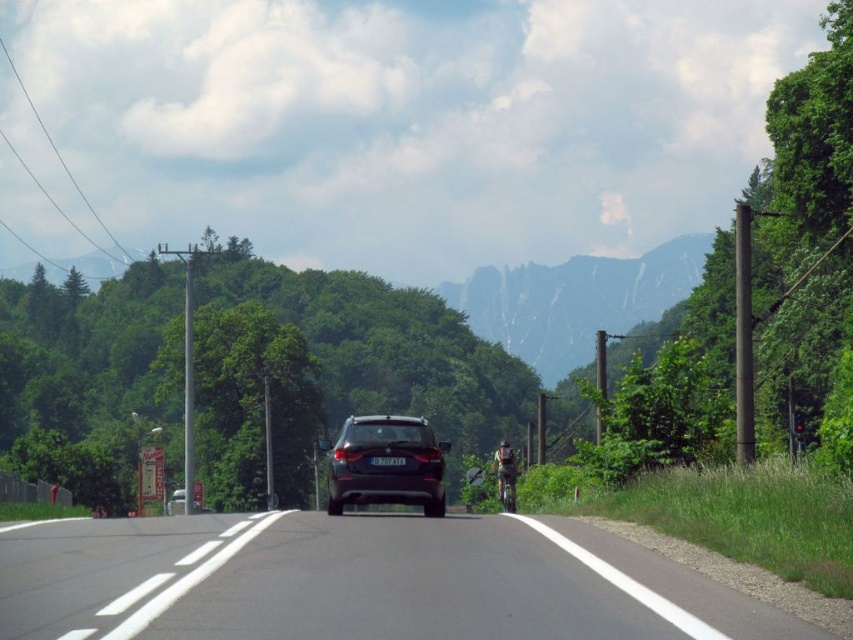
Who is shorter, black asphalt road at center or shiny metallic motorcycle at center?

black asphalt road at center is shorter.

Is black asphalt road at center shorter than shiny metallic motorcycle at center?

Yes, black asphalt road at center is shorter than shiny metallic motorcycle at center.

Is point (416, 564) closer to camera compared to point (512, 472)?

Yes, it is.

This screenshot has width=853, height=640. In order to click on black asphalt road at center in this screenshot , I will do `click(360, 580)`.

This screenshot has height=640, width=853. Find the location of `satin black car at center`. satin black car at center is located at coordinates (x=386, y=464).

Between satin black car at center and shiny metallic motorcycle at center, which one is positioned lower?

satin black car at center

Find the location of a particular element. The width and height of the screenshot is (853, 640). satin black car at center is located at coordinates (386, 464).

Is point (500, 460) positioned before point (515, 499)?

That is True.

Is green fabric jacket at center to the right of shiny metallic motorcycle at center from the viewer's perspective?

Correct, you'll find green fabric jacket at center to the right of shiny metallic motorcycle at center.

Is point (514, 497) behind point (505, 506)?

No, it is in front of (505, 506).

Where is `green fabric jacket at center`? green fabric jacket at center is located at coordinates (505, 468).